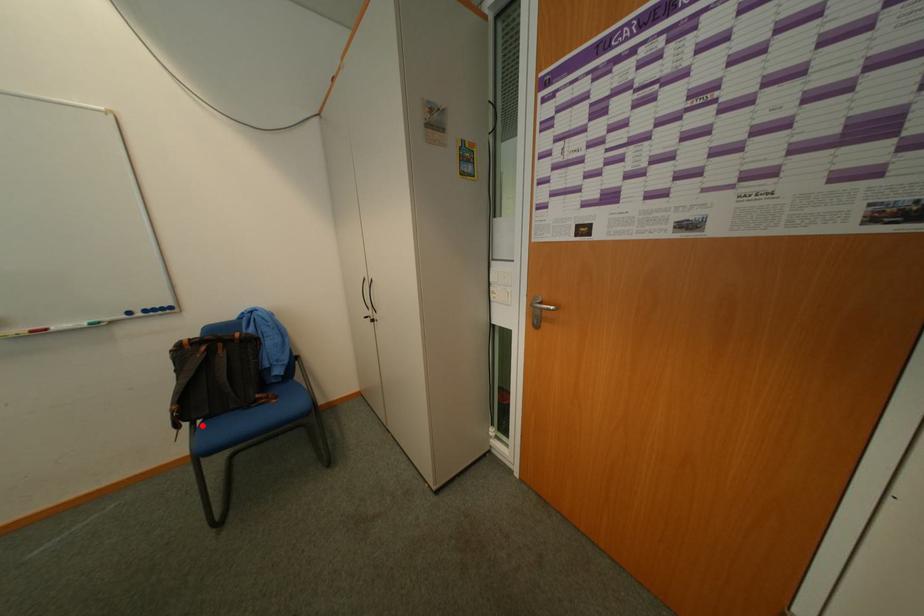
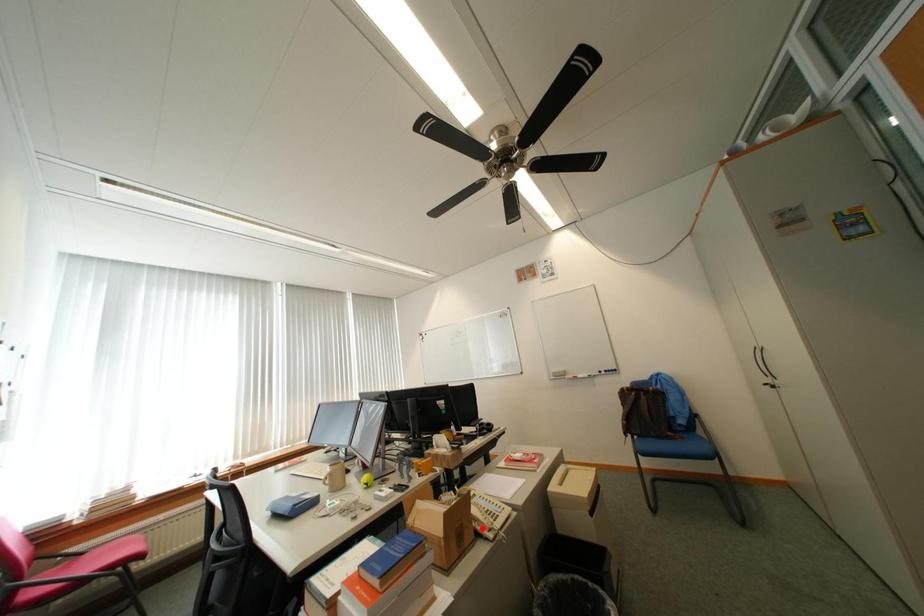
I am providing you with two images of the same scene from different viewpoints. A red point is marked on the first image and another point is marked on the second image. Do the highlighted points in image1 and image2 indicate the same real-world spot?

No